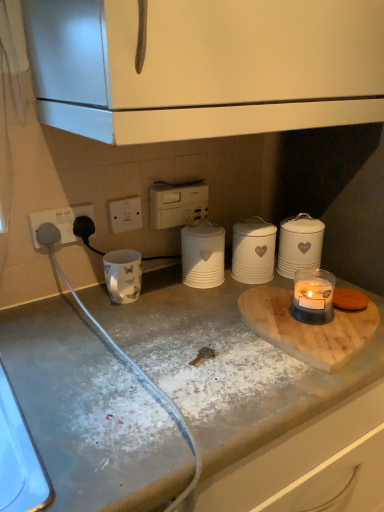
Question: Should I look upward or downward to see white ceramic canister at center-right, positioned as the second kitchen appliance in left-to-right order?

Choices:
 (A) up
 (B) down

Answer: (A)

Question: Is white plastic electric outlet at center bigger than white speckled concrete at center?

Choices:
 (A) no
 (B) yes

Answer: (A)

Question: Is white plastic electric outlet at center oriented away from white speckled concrete at center?

Choices:
 (A) no
 (B) yes

Answer: (A)

Question: Can you confirm if white plastic electric outlet at center is thinner than white speckled concrete at center?

Choices:
 (A) yes
 (B) no

Answer: (A)

Question: Is white plastic electric outlet at center next to white speckled concrete at center?

Choices:
 (A) no
 (B) yes

Answer: (A)

Question: Is white plastic electric outlet at center not within white speckled concrete at center?

Choices:
 (A) yes
 (B) no

Answer: (A)

Question: Is white plastic electric outlet at center smaller than white speckled concrete at center?

Choices:
 (A) yes
 (B) no

Answer: (A)

Question: Can you confirm if wooden cutting board at center is positioned to the left of white ceramic canister at center, the 1th appliance from the bottom?

Choices:
 (A) no
 (B) yes

Answer: (A)

Question: Does wooden cutting board at center come behind white ceramic canister at center, which ranks as the 2th appliance in top-to-bottom order?

Choices:
 (A) no
 (B) yes

Answer: (A)

Question: Is white ceramic canister at center, which ranks as the 2th appliance in top-to-bottom order, a part of wooden cutting board at center?

Choices:
 (A) no
 (B) yes

Answer: (A)

Question: Is wooden cutting board at center oriented away from white ceramic canister at center, the 1th appliance from the bottom?

Choices:
 (A) yes
 (B) no

Answer: (B)

Question: From a real-world perspective, is wooden cutting board at center positioned over white ceramic canister at center, which ranks as the 2th appliance in top-to-bottom order, based on gravity?

Choices:
 (A) no
 (B) yes

Answer: (A)

Question: Is wooden cutting board at center located outside white ceramic canister at center, which ranks as the 2th appliance in top-to-bottom order?

Choices:
 (A) yes
 (B) no

Answer: (A)

Question: From a real-world perspective, is translucent glass candle at lower right over white matte cabinet at upper center?

Choices:
 (A) no
 (B) yes

Answer: (A)